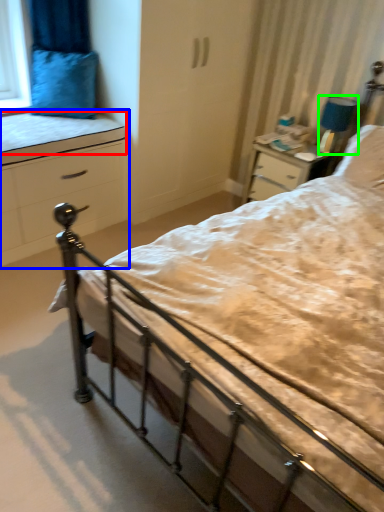
Question: Based on their relative distances, which object is farther from mattress (highlighted by a red box)? Choose from chest of drawers (highlighted by a blue box) and lamp (highlighted by a green box).

Choices:
 (A) chest of drawers
 (B) lamp

Answer: (B)